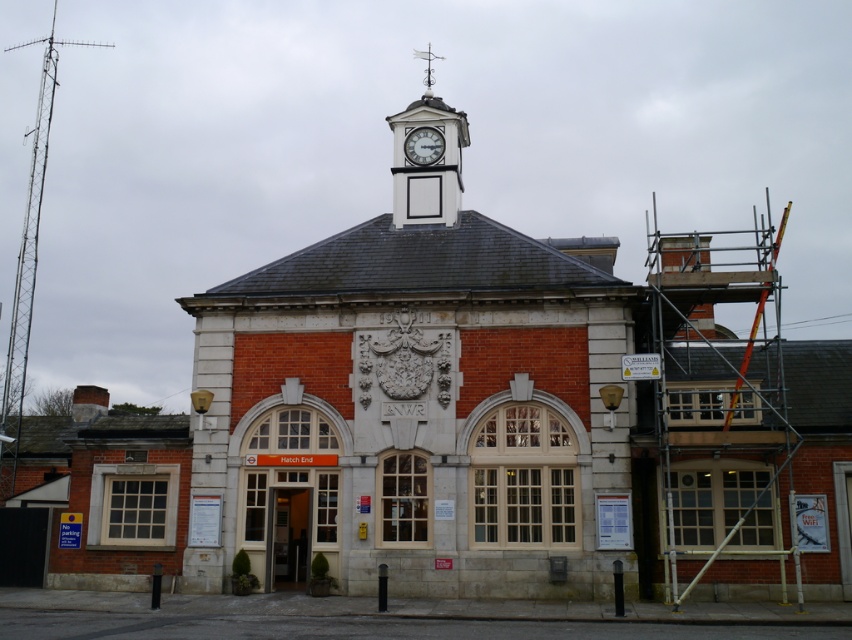
Question: Can you confirm if white painted wood clock tower at upper center is smaller than white glossy clock at upper center?

Choices:
 (A) yes
 (B) no

Answer: (B)

Question: Which point is closer to the camera?

Choices:
 (A) (406, 154)
 (B) (423, 192)

Answer: (B)

Question: Does white painted wood clock tower at upper center appear on the left side of white glossy clock at upper center?

Choices:
 (A) no
 (B) yes

Answer: (B)

Question: Which of the following is the farthest from the observer?

Choices:
 (A) (409, 134)
 (B) (418, 136)

Answer: (B)

Question: Does white painted wood clock tower at upper center have a smaller size compared to white glossy clock at upper center?

Choices:
 (A) no
 (B) yes

Answer: (A)